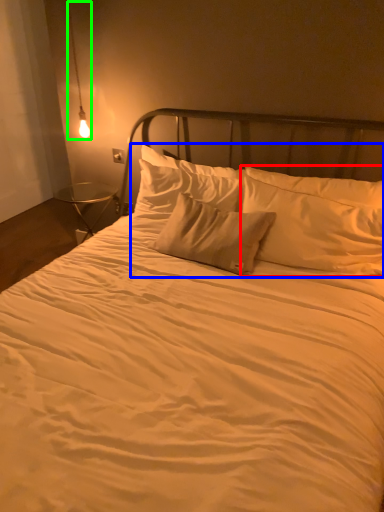
Question: Considering the real-world distances, which object is closest to pillow (highlighted by a red box)? pillow (highlighted by a blue box) or lamp (highlighted by a green box).

Choices:
 (A) pillow
 (B) lamp

Answer: (A)